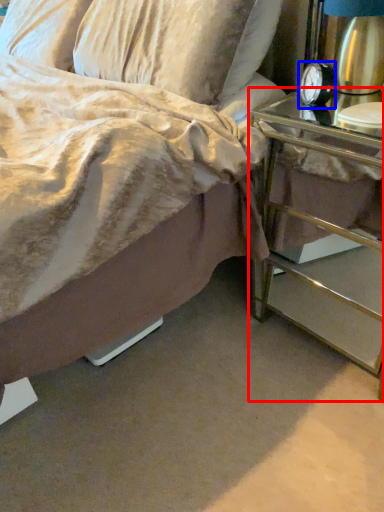
Question: Which of the following is the farthest to the observer, nightstand (highlighted by a red box) or alarm clock (highlighted by a blue box)?

Choices:
 (A) nightstand
 (B) alarm clock

Answer: (B)